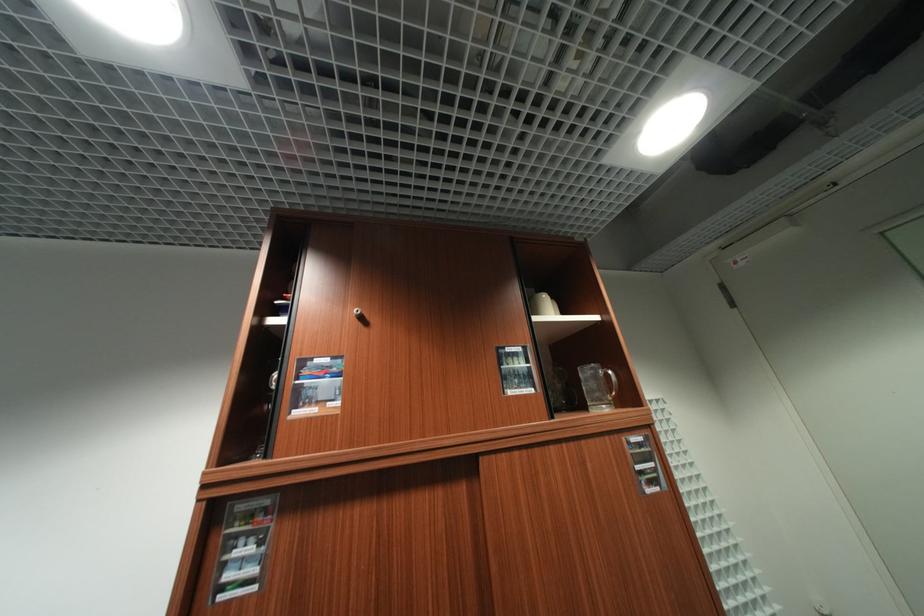
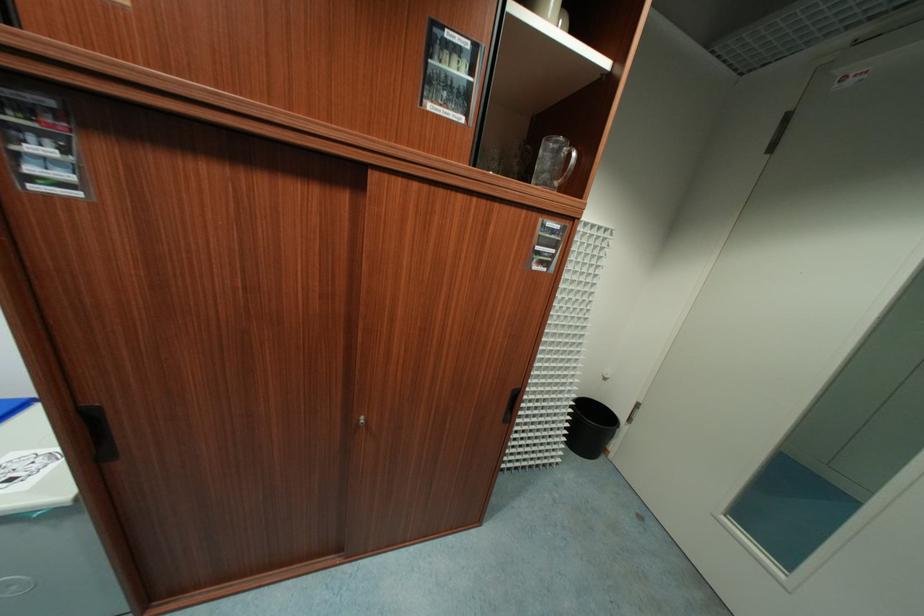
The point at [602,374] is marked in the first image. Where is the corresponding point in the second image?

(565, 151)